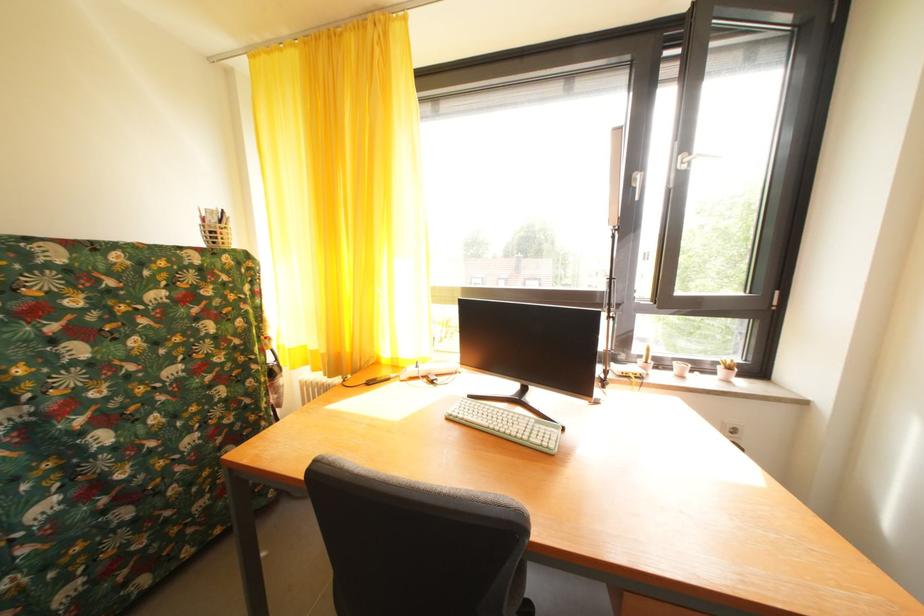
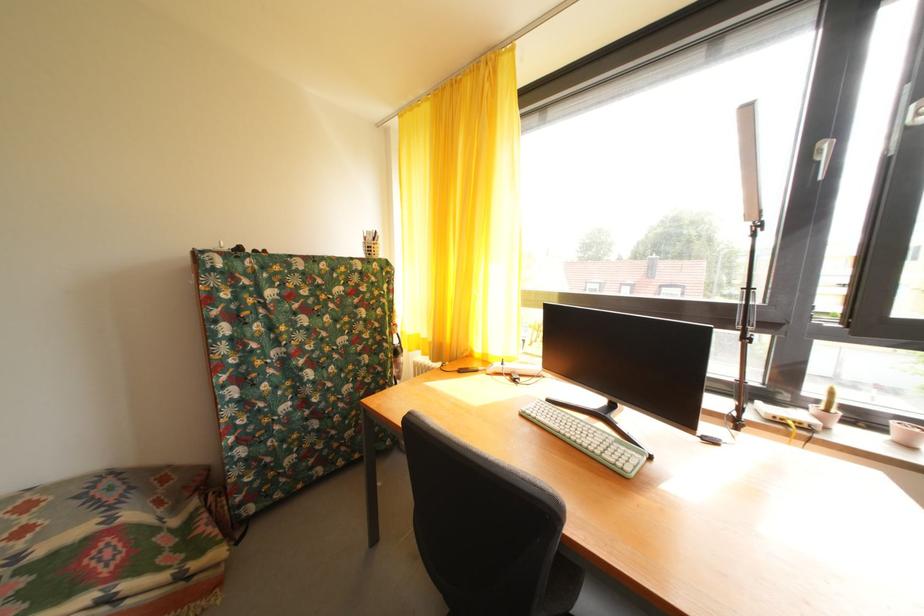
The point at (322, 359) is marked in the first image. Where is the corresponding point in the second image?

(432, 346)